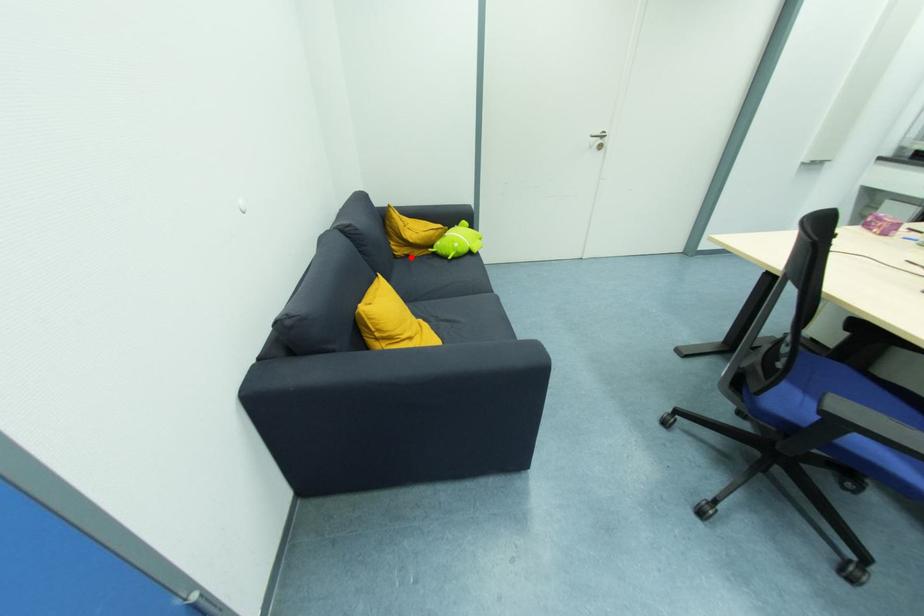
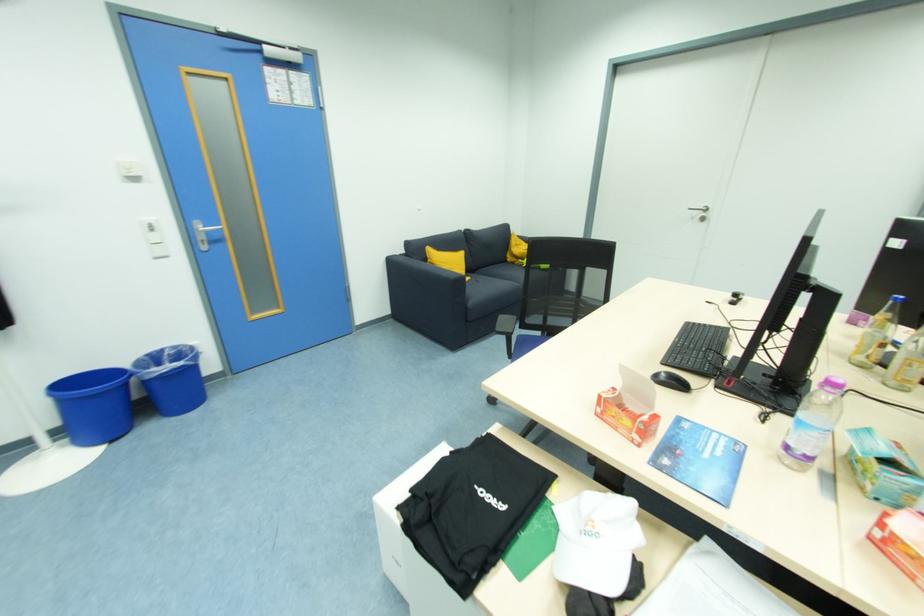
Where in the second image is the point corresponding to the highlighted location from the first image?

(516, 265)